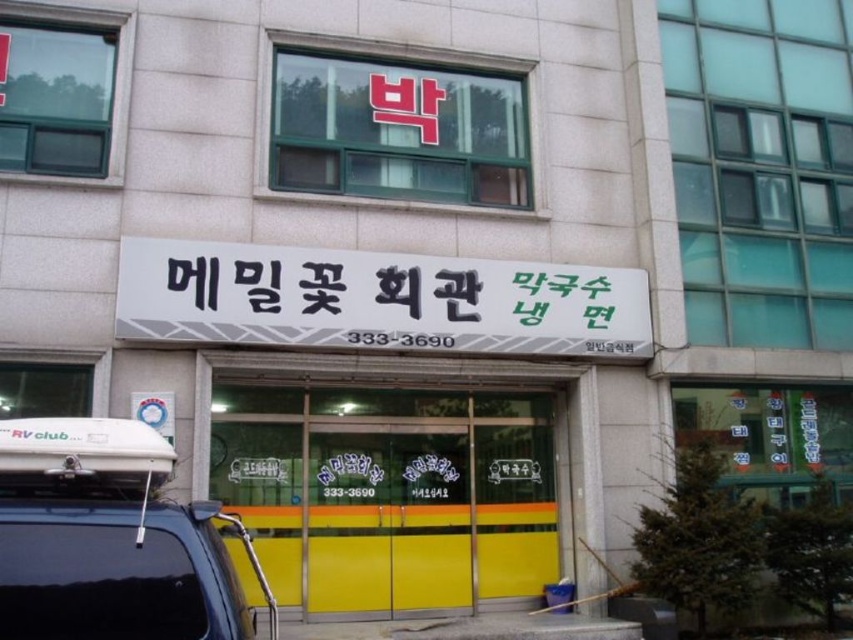
What is located at the point with coordinates (x=376, y=300) in the image?

The point at coordinates (x=376, y=300) indicates a black plastic signboard at center.

You are a delivery person arriving at the Rice Noodle Flower Hall. You need to enter the building but are unsure which entrance to use. Based on the scene, which object should you approach first, the yellow matte door at center or the black plastic signboard at center?

The yellow matte door at center is bigger than the black plastic signboard at center, so you should approach the yellow matte door at center first as it is likely the entrance.

You are a delivery person trying to enter the Rice Noodle Flower Hall. You see the yellow matte door at center and the black plastic signboard at center. Which one is narrower?

The yellow matte door at center is thinner than the black plastic signboard at center, so the yellow matte door at center is narrower.